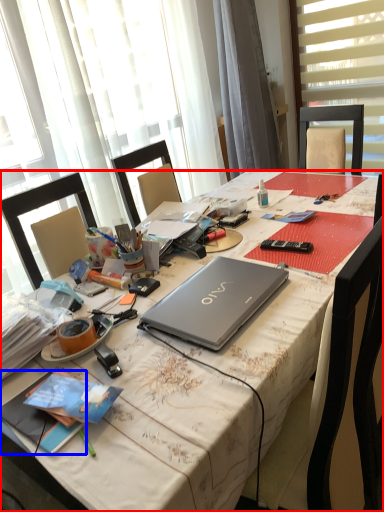
Question: Which of the following is the closest to the observer, desk (highlighted by a red box) or book (highlighted by a blue box)?

Choices:
 (A) desk
 (B) book

Answer: (A)